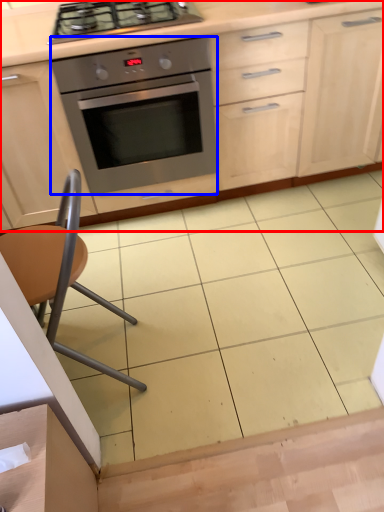
Question: Which of the following is the farthest to the observer, cabinetry (highlighted by a red box) or oven (highlighted by a blue box)?

Choices:
 (A) cabinetry
 (B) oven

Answer: (B)